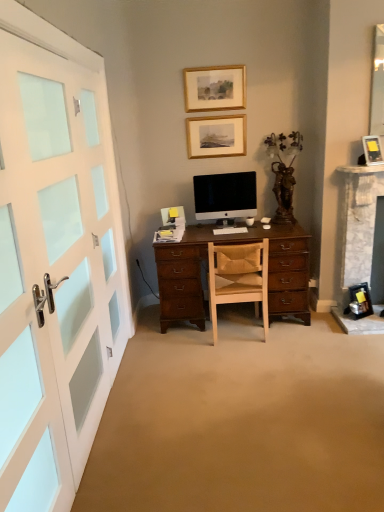
Question: From the image's perspective, is matte black picture frame at upper right, which appears as the first picture frame when viewed from the right, located beneath white painted wood door at left?

Choices:
 (A) yes
 (B) no

Answer: (B)

Question: Considering the relative sizes of matte black picture frame at upper right, which appears as the third picture frame when viewed from the top, and white painted wood door at left in the image provided, is matte black picture frame at upper right, which appears as the third picture frame when viewed from the top, wider than white painted wood door at left?

Choices:
 (A) yes
 (B) no

Answer: (A)

Question: From the image's perspective, does matte black picture frame at upper right, which is the 3th picture frame in back-to-front order, appear higher than white painted wood door at left?

Choices:
 (A) no
 (B) yes

Answer: (B)

Question: Is matte black picture frame at upper right, which is counted as the 3th picture frame, starting from the left, thinner than white painted wood door at left?

Choices:
 (A) no
 (B) yes

Answer: (A)

Question: Is matte black picture frame at upper right, which is the 3th picture frame in back-to-front order, at the right side of white painted wood door at left?

Choices:
 (A) yes
 (B) no

Answer: (A)

Question: In terms of width, does white matte computer keyboard at center look wider or thinner when compared to white glossy computer mouse at center?

Choices:
 (A) thin
 (B) wide

Answer: (B)

Question: Considering the positions of white matte computer keyboard at center and white glossy computer mouse at center in the image, is white matte computer keyboard at center taller or shorter than white glossy computer mouse at center?

Choices:
 (A) short
 (B) tall

Answer: (B)

Question: From a real-world perspective, relative to white glossy computer mouse at center, is white matte computer keyboard at center vertically above or below?

Choices:
 (A) above
 (B) below

Answer: (B)

Question: Looking at the image, does white matte computer keyboard at center seem bigger or smaller compared to white glossy computer mouse at center?

Choices:
 (A) big
 (B) small

Answer: (A)

Question: From the image's perspective, is white matte computer keyboard at center located above or below white painted wood door at left?

Choices:
 (A) above
 (B) below

Answer: (A)

Question: Is white matte computer keyboard at center wider or thinner than white painted wood door at left?

Choices:
 (A) thin
 (B) wide

Answer: (B)

Question: Considering the relative positions of white matte computer keyboard at center and white painted wood door at left in the image provided, is white matte computer keyboard at center to the left or to the right of white painted wood door at left?

Choices:
 (A) right
 (B) left

Answer: (A)

Question: Considering their positions, is white matte computer keyboard at center located in front of or behind white painted wood door at left?

Choices:
 (A) front
 (B) behind

Answer: (B)

Question: Is brown wooden statue at upper right wider or thinner than satin black monitor at center?

Choices:
 (A) wide
 (B) thin

Answer: (A)

Question: Considering the relative positions of brown wooden statue at upper right and satin black monitor at center in the image provided, is brown wooden statue at upper right to the left or to the right of satin black monitor at center?

Choices:
 (A) left
 (B) right

Answer: (B)